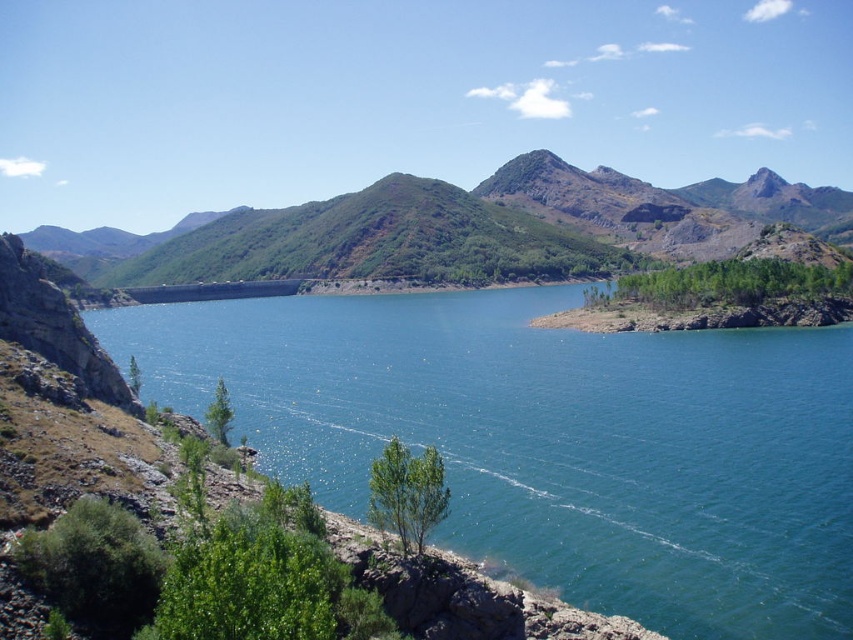
Question: Does blue water at center appear on the left side of green textured mountain at center?

Choices:
 (A) no
 (B) yes

Answer: (B)

Question: Which point is farther to the camera?

Choices:
 (A) green textured mountain at center
 (B) blue water at center

Answer: (A)

Question: Does blue water at center appear under green textured mountain at center?

Choices:
 (A) no
 (B) yes

Answer: (B)

Question: Observing the image, what is the correct spatial positioning of blue water at center in reference to green textured mountain at center?

Choices:
 (A) above
 (B) below

Answer: (B)

Question: Among these points, which one is nearest to the camera?

Choices:
 (A) (849, 221)
 (B) (378, 330)

Answer: (B)